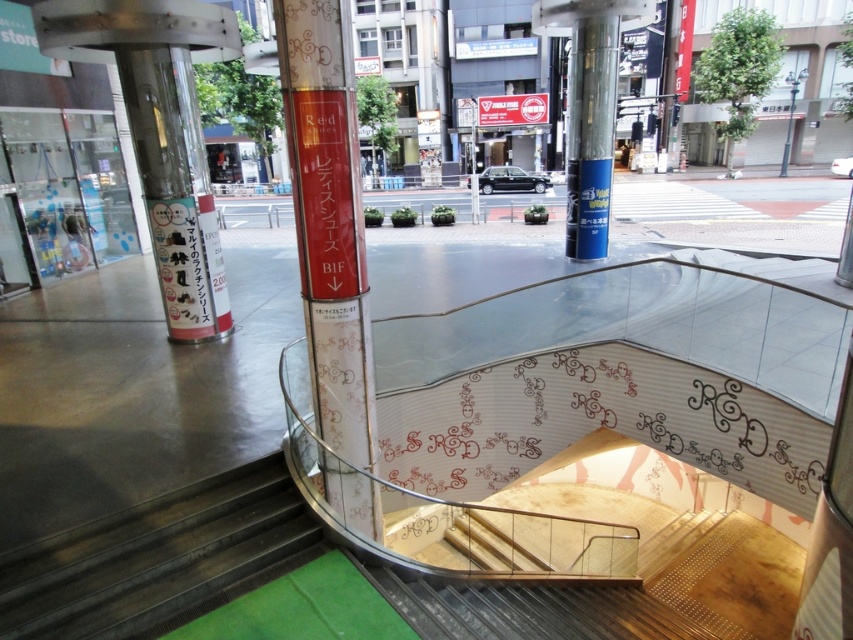
Does matte pink column at center come in front of black metal pole at upper right?

That is True.

Describe the element at coordinates (328, 220) in the screenshot. The width and height of the screenshot is (853, 640). I see `matte pink column at center` at that location.

Image resolution: width=853 pixels, height=640 pixels. What do you see at coordinates (328, 220) in the screenshot? I see `matte pink column at center` at bounding box center [328, 220].

I want to click on matte pink column at center, so click(328, 220).

Who is shorter, metallic silver pillar at left or blue glossy pillar at center?

With less height is metallic silver pillar at left.

Where is `metallic silver pillar at left`? Image resolution: width=853 pixels, height=640 pixels. metallic silver pillar at left is located at coordinates (160, 131).

Which is above, metallic silver pillar at left or black metal pole at upper right?

Positioned higher is black metal pole at upper right.

Does metallic silver pillar at left have a smaller size compared to black metal pole at upper right?

No, metallic silver pillar at left is not smaller than black metal pole at upper right.

Between point (181, 157) and point (793, 90), which one is positioned behind?

The point (793, 90) is behind.

The image size is (853, 640). Find the location of `metallic silver pillar at left`. metallic silver pillar at left is located at coordinates (160, 131).